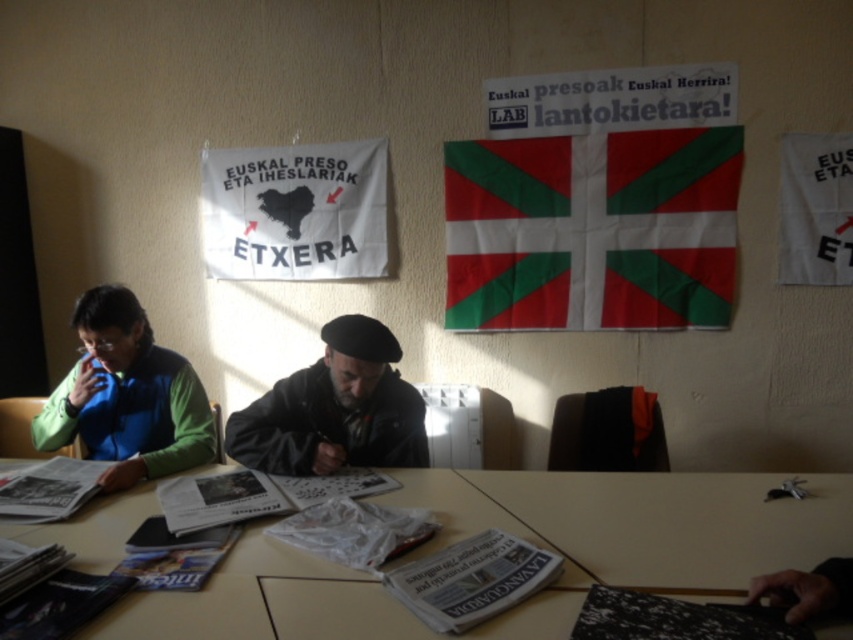
You are a guest at this table. You want to place a 15cm tall candle on the wooden table at center. Can the dark gray beret at center be placed on top of the candle without touching the table?

The wooden table at center is shorter than the dark gray beret at center. Since the candle is 15cm tall, the beret would extend above the candle, but the question is about placing the beret on top of the candle without touching the table. If the candle is placed on the table, the beret on top would still touch the candle, but the table height isn

You are organizing a charity clothing drive and need to determine which jackets to pack first. Given the green fabric jacket at center and the green matte jacket at left, which one should you prioritize if you have limited space and want to pack the smaller jacket first?

The green matte jacket at left is smaller than the green fabric jacket at center, so you should prioritize packing the green matte jacket at left first.